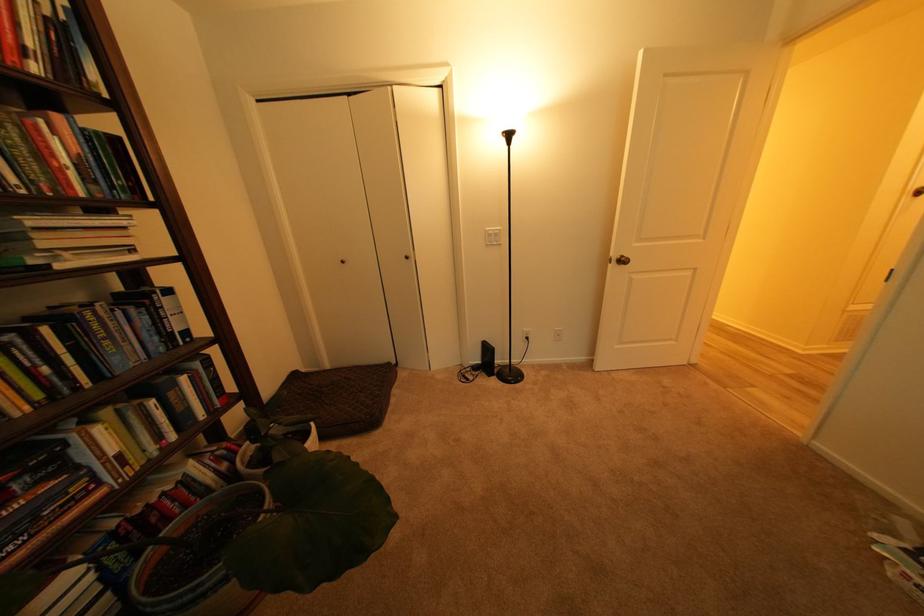
Locate an element on the screen. The image size is (924, 616). white light switch is located at coordinates (492, 236).